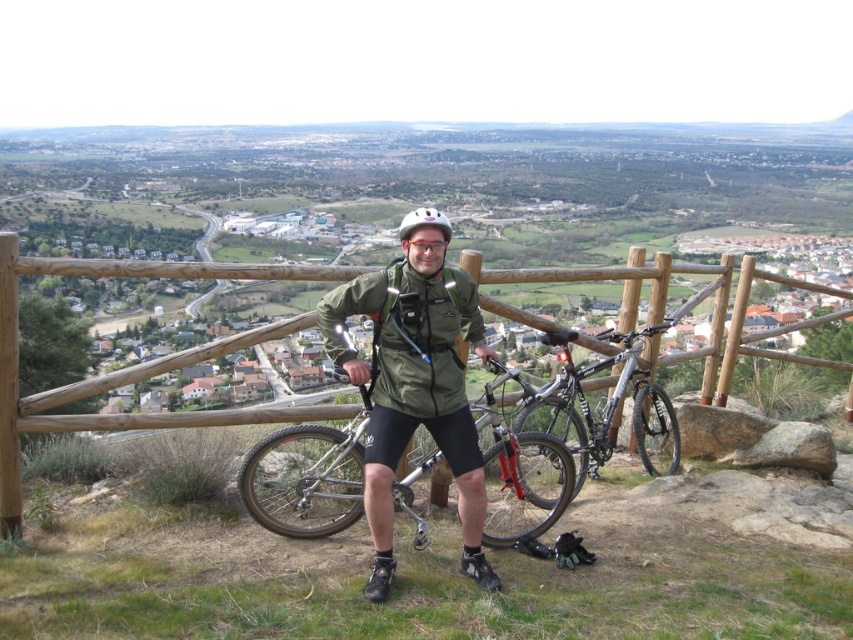
Consider the image. You are a photographer trying to capture a clear shot of the green matte jacket at center and the silver metallic mountain bike at center. Which object should you focus on first if you want to ensure both are in focus without moving the camera?

The green matte jacket at center is closer to the viewer than the silver metallic mountain bike at center. To ensure both are in focus, you should focus on the silver metallic mountain bike at center first, as it is farther away, allowing the depth of field to cover the closer jacket.

Consider the image. You are a photographer trying to capture the cyclist wearing the green matte jacket at center. Based on the coordinates provided, where should you position your camera to ensure the jacket is centered in the frame?

The green matte jacket at center is located at coordinates point (415, 381), so you should position your camera to focus on that point to center the jacket in the frame.